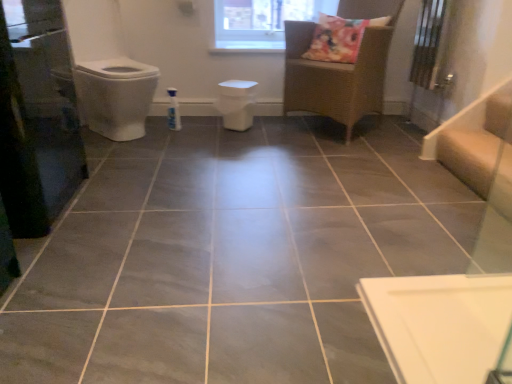
Describe the element at coordinates (236, 103) in the screenshot. I see `white matte toilet bowl at center` at that location.

The width and height of the screenshot is (512, 384). I want to click on beige wood stairwell at right, so click(475, 140).

The width and height of the screenshot is (512, 384). Describe the element at coordinates (475, 140) in the screenshot. I see `beige wood stairwell at right` at that location.

Find the location of a particular element. This screenshot has height=384, width=512. woven rattan chair at upper center is located at coordinates (335, 77).

What is the approximate width of transparent glass window at upper center?

The width of transparent glass window at upper center is 9.64 centimeters.

Describe the element at coordinates (37, 118) in the screenshot. The image size is (512, 384). I see `transparent glass screen door at left` at that location.

The width and height of the screenshot is (512, 384). What are the coordinates of `white matte toilet bowl at center` in the screenshot? It's located at (236, 103).

Based on the photo, is woven rattan chair at upper center inside transparent glass window at upper center?

No, woven rattan chair at upper center is not a part of transparent glass window at upper center.

Between transparent glass window at upper center and woven rattan chair at upper center, which one has smaller width?

transparent glass window at upper center.

From a real-world perspective, is transparent glass window at upper center physically located above or below woven rattan chair at upper center?

From a real-world perspective, transparent glass window at upper center is physically above woven rattan chair at upper center.

Is transparent glass window at upper center taller than transparent glass screen door at left?

In fact, transparent glass window at upper center may be shorter than transparent glass screen door at left.

This screenshot has width=512, height=384. What are the coordinates of `screen door located below the transparent glass window at upper center (from the image's perspective)` in the screenshot? It's located at (37, 118).

Who is bigger, transparent glass window at upper center or transparent glass screen door at left?

transparent glass screen door at left is bigger.

Can you confirm if transparent glass window at upper center is thinner than transparent glass screen door at left?

Yes, transparent glass window at upper center is thinner than transparent glass screen door at left.

Who is taller, woven rattan chair at upper center or white matte toilet bowl at center?

woven rattan chair at upper center.

Which object is further away from the camera, woven rattan chair at upper center or white matte toilet bowl at center?

Positioned behind is white matte toilet bowl at center.

From the image's perspective, relative to white matte toilet bowl at center, is woven rattan chair at upper center above or below?

Based on their image positions, woven rattan chair at upper center is located above white matte toilet bowl at center.

Considering the sizes of woven rattan chair at upper center and white matte toilet bowl at center in the image, is woven rattan chair at upper center wider or thinner than white matte toilet bowl at center?

Clearly, woven rattan chair at upper center has more width compared to white matte toilet bowl at center.

Does point (317, 113) lie behind point (54, 50)?

Yes.

Is woven rattan chair at upper center inside the boundaries of transparent glass screen door at left, or outside?

The correct answer is: outside.

Is woven rattan chair at upper center wider than transparent glass screen door at left?

Indeed, woven rattan chair at upper center has a greater width compared to transparent glass screen door at left.

Which is closer to the camera, (490, 133) or (53, 160)?

Point (490, 133) is farther from the camera than point (53, 160).

Between beige wood stairwell at right and transparent glass screen door at left, which one has more height?

transparent glass screen door at left is taller.

From a real-world perspective, which object stands above the other?

transparent glass screen door at left.

Is point (230, 111) closer or farther from the camera than point (234, 42)?

Point (230, 111) is positioned closer to the camera compared to point (234, 42).

From a real-world perspective, who is located higher, white matte toilet bowl at center or transparent glass window at upper center?

transparent glass window at upper center.

Could you tell me if white matte toilet bowl at center is turned towards transparent glass window at upper center?

No, white matte toilet bowl at center is not aimed at transparent glass window at upper center.

Is transparent glass window at upper center a part of white matte toilet bowl at center?

Actually, transparent glass window at upper center is outside white matte toilet bowl at center.

In the scene shown: Which of these two, woven rattan chair at upper center or beige wood stairwell at right, is smaller?

Smaller between the two is beige wood stairwell at right.

Which of these two, woven rattan chair at upper center or beige wood stairwell at right, stands shorter?

beige wood stairwell at right.

You are a GUI agent. You are given a task and a screenshot of the screen. Output one action in this format:
    pyautogui.click(x=<x>, y=<y>)
    Task: Click on the stairwell below the woven rattan chair at upper center (from a real-world perspective)
    Image resolution: width=512 pixels, height=384 pixels.
    Given the screenshot: What is the action you would take?
    pyautogui.click(x=475, y=140)

Could beige wood stairwell at right be considered to be inside woven rattan chair at upper center?

No, beige wood stairwell at right is not surrounded by woven rattan chair at upper center.

You are a GUI agent. You are given a task and a screenshot of the screen. Output one action in this format:
    pyautogui.click(x=<x>, y=<y>)
    Task: Click on the furniture lying below the transparent glass window at upper center (from the image's perspective)
    This screenshot has height=384, width=512.
    Given the screenshot: What is the action you would take?
    335,77

This screenshot has height=384, width=512. In order to click on window behind the transparent glass screen door at left in this screenshot , I will do `click(261, 22)`.

When comparing their distances from transparent glass window at upper center, does white matte toilet bowl at center or beige wood stairwell at right seem closer?

white matte toilet bowl at center.

Considering their positions, is woven rattan chair at upper center positioned closer to white matte toilet bowl at center than transparent glass window at upper center?

woven rattan chair at upper center is positioned closer to the anchor white matte toilet bowl at center.

Looking at the image, which one is located further to beige wood stairwell at right, transparent glass screen door at left or woven rattan chair at upper center?

transparent glass screen door at left is positioned further to the anchor beige wood stairwell at right.

From the image, which object appears to be nearer to white matte toilet bowl at center, transparent glass screen door at left or woven rattan chair at upper center?

woven rattan chair at upper center.

Considering their positions, is beige wood stairwell at right positioned closer to transparent glass window at upper center than transparent glass screen door at left?

The object closer to transparent glass window at upper center is beige wood stairwell at right.

Based on their spatial positions, is beige wood stairwell at right or white matte toilet bowl at center closer to woven rattan chair at upper center?

white matte toilet bowl at center.

When comparing their distances from white matte toilet bowl at center, does transparent glass window at upper center or beige wood stairwell at right seem closer?

Based on the image, transparent glass window at upper center appears to be nearer to white matte toilet bowl at center.

In the scene shown: Looking at the image, which one is located further to transparent glass window at upper center, white matte toilet bowl at center or woven rattan chair at upper center?

Among the two, woven rattan chair at upper center is located further to transparent glass window at upper center.

Find the location of a particular element. This screenshot has height=384, width=512. furniture between beige wood stairwell at right and transparent glass window at upper center in the front-back direction is located at coordinates (335, 77).

You are a GUI agent. You are given a task and a screenshot of the screen. Output one action in this format:
    pyautogui.click(x=<x>, y=<y>)
    Task: Click on the furniture between white matte toilet bowl at center and beige wood stairwell at right
    The height and width of the screenshot is (384, 512).
    Given the screenshot: What is the action you would take?
    pyautogui.click(x=335, y=77)

You are a GUI agent. You are given a task and a screenshot of the screen. Output one action in this format:
    pyautogui.click(x=<x>, y=<y>)
    Task: Click on the toilet bowl located between transparent glass screen door at left and woven rattan chair at upper center in the left-right direction
    
    Given the screenshot: What is the action you would take?
    pyautogui.click(x=236, y=103)

I want to click on toilet bowl between woven rattan chair at upper center and transparent glass window at upper center in the front-back direction, so click(236, 103).